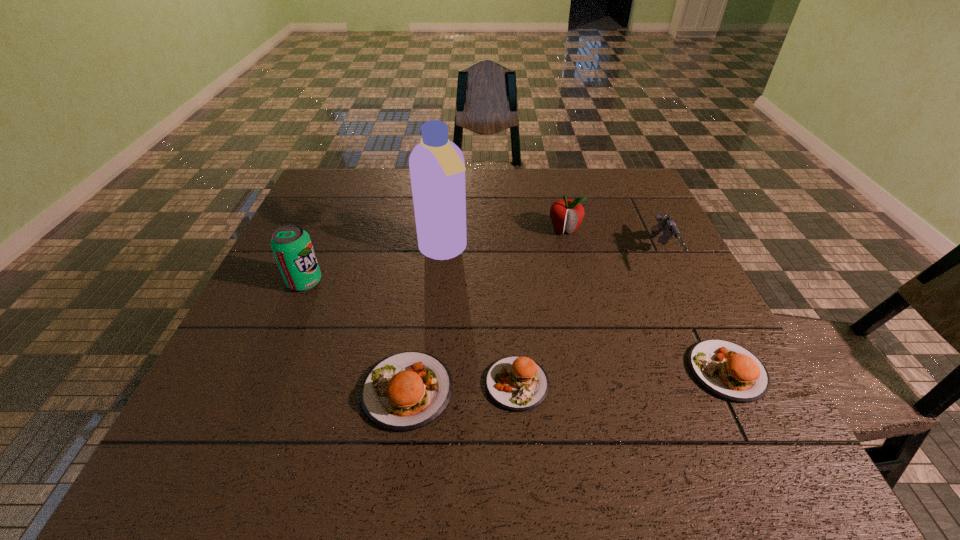
Locate an element on the screen. The width and height of the screenshot is (960, 540). free point located 0.200m on the left of the leftmost patty is located at coordinates (257, 390).

Find the location of `free space located 0.080m on the right of the shortest patty`. free space located 0.080m on the right of the shortest patty is located at coordinates (590, 383).

In order to click on free space located on the left of the rightmost patty in this screenshot , I will do `click(639, 370)`.

The width and height of the screenshot is (960, 540). Identify the location of vacant point located on the left of the apple. (408, 230).

The height and width of the screenshot is (540, 960). I want to click on vacant space located on the right of the tallest object, so click(616, 251).

At what (x,y) coordinates should I click in order to perform the action: click on vacant space situated 0.340m at the barrel of the gun. Please return your answer as a coordinate pair (x, y). The height and width of the screenshot is (540, 960). Looking at the image, I should click on (734, 406).

Identify the location of free space located 0.290m on the front-facing side of the sixth shortest object. (442, 282).

What are the coordinates of `object located at the left edge` in the screenshot? It's located at (292, 247).

This screenshot has height=540, width=960. I want to click on patty that is at the right edge, so click(x=728, y=370).

Identify the location of gun that is at the right edge. (666, 224).